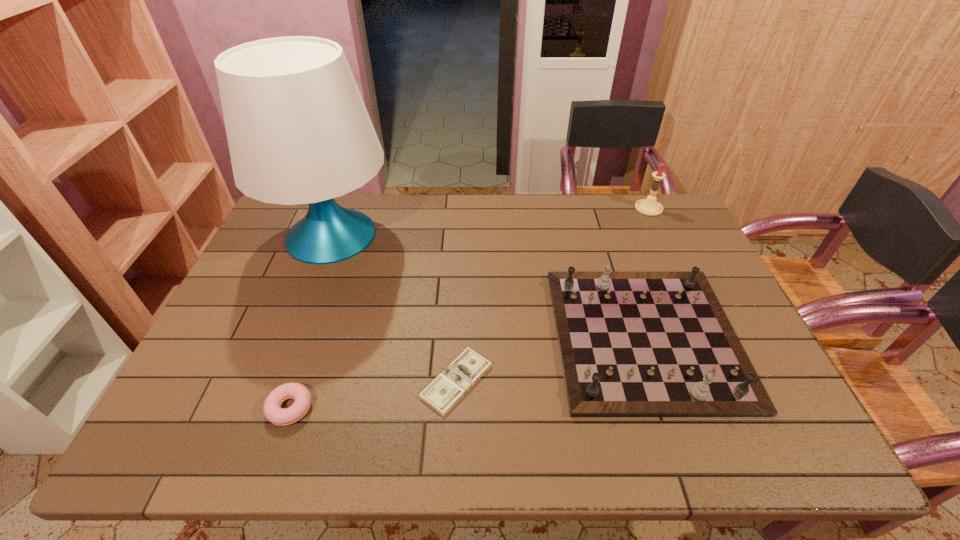
Locate an element on the screen. The height and width of the screenshot is (540, 960). table lamp located in the far edge section of the desktop is located at coordinates (298, 131).

Where is `candle that is positioned at the far edge`? The image size is (960, 540). candle that is positioned at the far edge is located at coordinates (650, 207).

This screenshot has height=540, width=960. Find the location of `object present at the near edge`. object present at the near edge is located at coordinates (273, 412).

Where is `object situated at the left edge`? Image resolution: width=960 pixels, height=540 pixels. object situated at the left edge is located at coordinates (298, 131).

Find the location of a particular element. candle at the right edge is located at coordinates pos(650,207).

Find the location of a particular element. This screenshot has width=960, height=540. chessboard located at the right edge is located at coordinates (632, 344).

Identify the location of object that is at the far left corner. (298, 131).

Find the location of a particular element. The height and width of the screenshot is (540, 960). object that is at the far right corner is located at coordinates (650, 207).

The width and height of the screenshot is (960, 540). Identify the location of free spot at the far edge of the desktop. (562, 221).

In order to click on free space at the near edge of the desktop in this screenshot , I will do `click(396, 417)`.